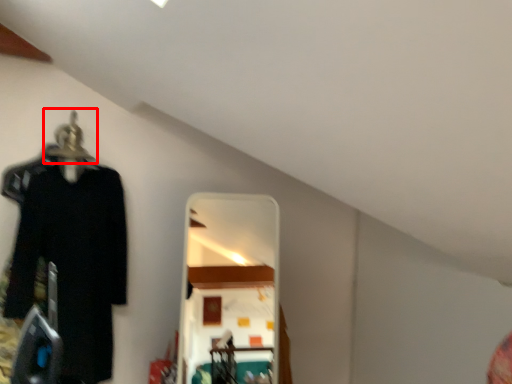
Question: Observing the image, what is the correct spatial positioning of hanger (annotated by the red box) in reference to clothing?

Choices:
 (A) right
 (B) left

Answer: (B)